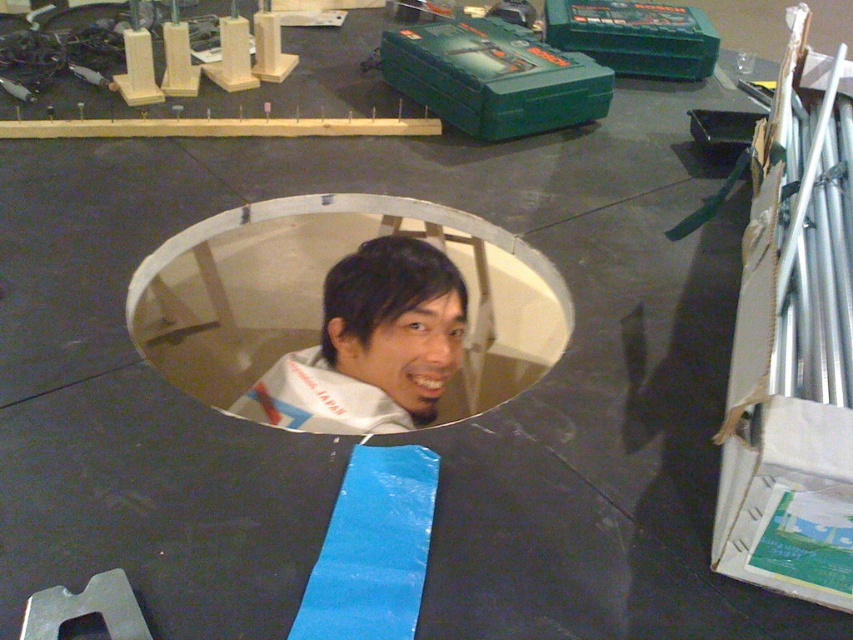
You are an engineer inspecting the machinery. You notice the white plastic hole at center and the white fabric at center. Which one has a greater width?

The white plastic hole at center has a greater width than the white fabric at center.

You are an inspector checking the machinery. You see the white plastic hole at center and the white fabric at center. Which one is nearer to you?

The white plastic hole at center is closer to the viewer than the white fabric at center, so the white plastic hole at center is nearer to you.